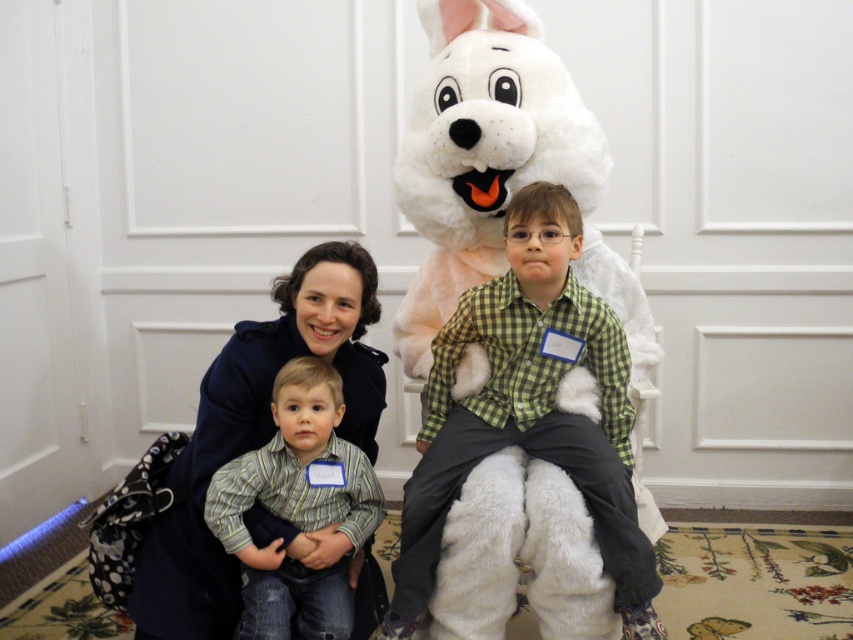
Question: Where is green checkered shirt at center located in relation to striped shirt at center in the image?

Choices:
 (A) above
 (B) below

Answer: (A)

Question: Is green checkered shirt at center in front of striped shirt at center?

Choices:
 (A) yes
 (B) no

Answer: (B)

Question: Which point appears farthest from the camera in this image?

Choices:
 (A) (622, 618)
 (B) (335, 566)

Answer: (B)

Question: Does green checkered shirt at center appear under striped shirt at center?

Choices:
 (A) yes
 (B) no

Answer: (B)